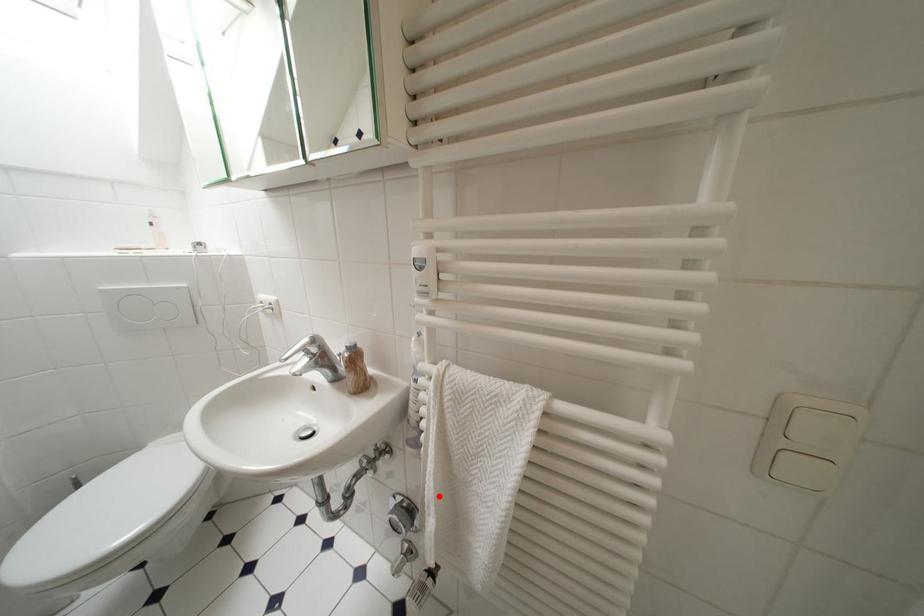
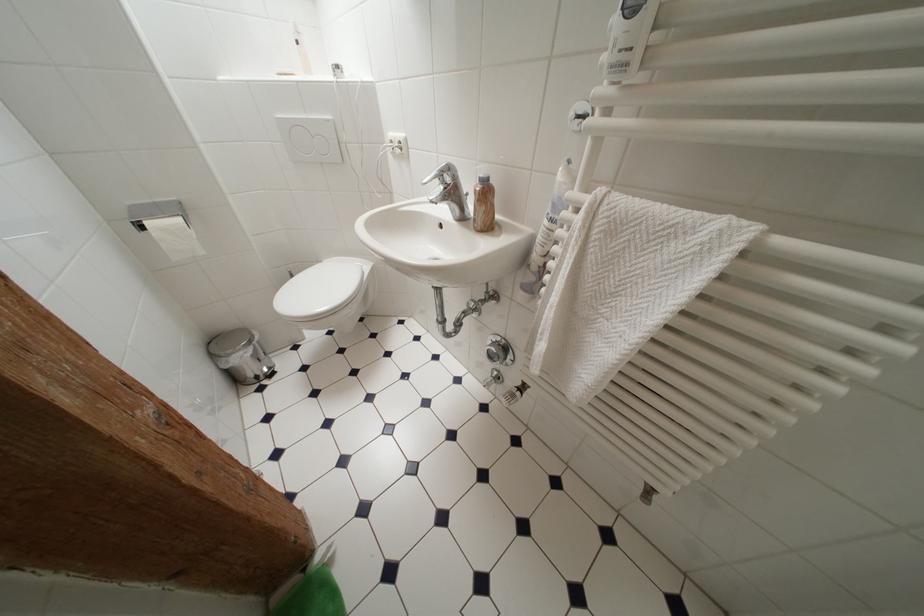
Question: I am providing you with two images of the same scene from different viewpoints. Image1 has a red point marked. In image2, the corresponding 3D location appears at what relative position? Reply with the corresponding letter.

Choices:
 (A) Closer
 (B) Farther

Answer: (A)